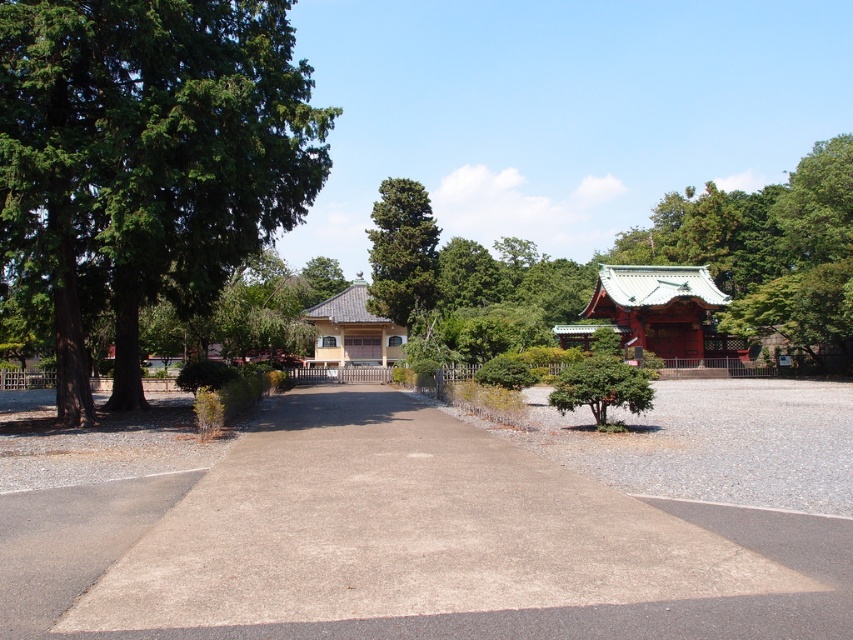
Question: Does gray concrete driveway at center appear under green textured tree at center?

Choices:
 (A) yes
 (B) no

Answer: (A)

Question: Which of the following is the farthest from the observer?

Choices:
 (A) (181, 93)
 (B) (401, 246)

Answer: (B)

Question: Which of the following is the closest to the observer?

Choices:
 (A) green leafy tree at left
 (B) gray concrete driveway at center
 (C) green textured tree at center

Answer: (B)

Question: Among these objects, which one is nearest to the camera?

Choices:
 (A) gray concrete driveway at center
 (B) green leafy tree at left

Answer: (A)

Question: Is green leafy tree at left positioned in front of green textured tree at center?

Choices:
 (A) no
 (B) yes

Answer: (B)

Question: In this image, where is gray concrete driveway at center located relative to green textured tree at center?

Choices:
 (A) below
 (B) above

Answer: (A)